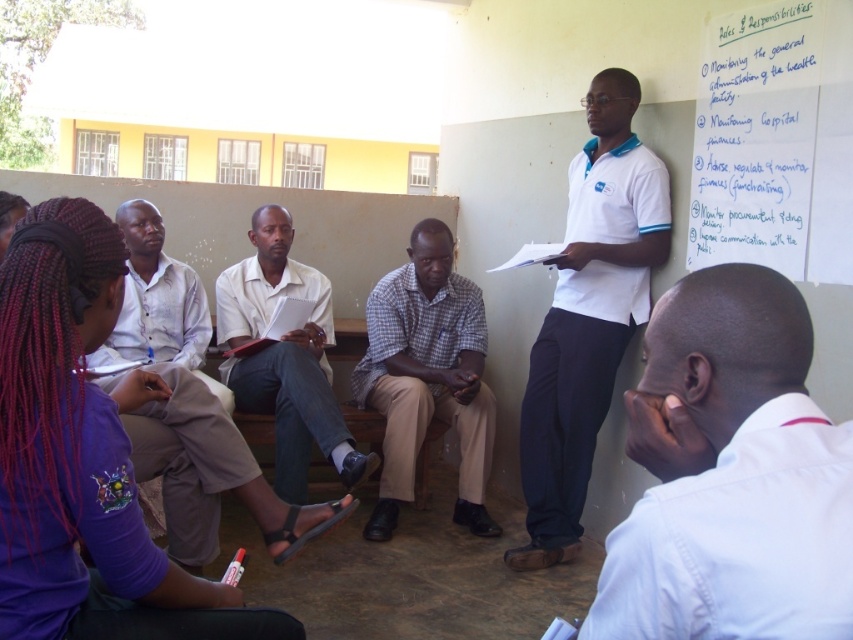
Between point (749, 349) and point (413, 349), which one is positioned in front?

Point (749, 349) is more forward.

Can you confirm if white shirt at upper right is thinner than plaid fabric shirt at center?

Yes.

You are a GUI agent. You are given a task and a screenshot of the screen. Output one action in this format:
    pyautogui.click(x=<x>, y=<y>)
    Task: Click on the white shirt at upper right
    This screenshot has width=853, height=640.
    Given the screenshot: What is the action you would take?
    pyautogui.click(x=730, y=476)

Can you confirm if white paper at upper right is positioned to the right of white shirt at center?

Yes, white paper at upper right is to the right of white shirt at center.

Can you confirm if white paper at upper right is shorter than white shirt at center?

Yes.

Between point (816, 61) and point (276, 436), which one is positioned behind?

The point (276, 436) is more distant.

The image size is (853, 640). I want to click on white paper at upper right, so click(x=775, y=141).

Is point (817, 49) positioned before point (461, 337)?

Yes, it is in front of point (461, 337).

Between white paper at upper right and plaid fabric shirt at center, which one has more height?

plaid fabric shirt at center

This screenshot has height=640, width=853. Find the location of `white paper at upper right`. white paper at upper right is located at coordinates (775, 141).